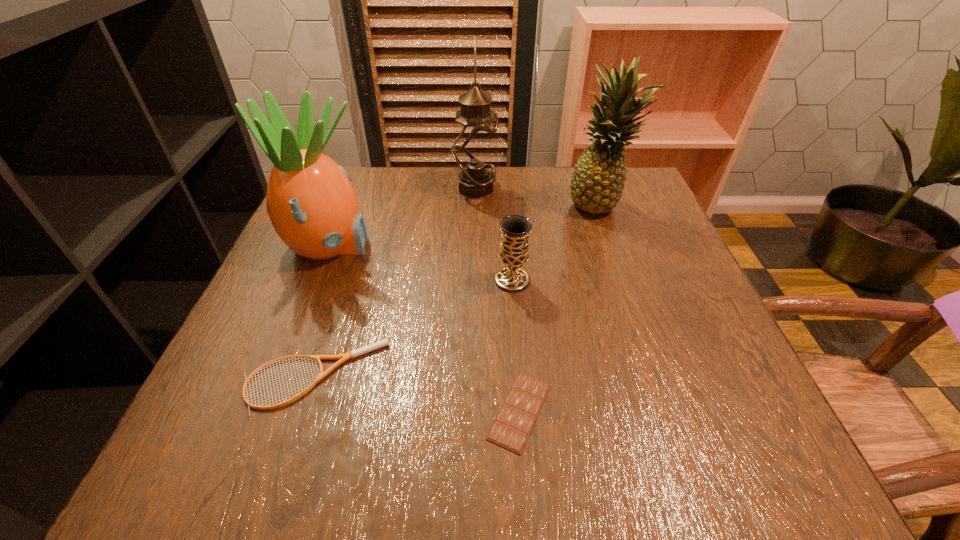
Image resolution: width=960 pixels, height=540 pixels. Identify the location of free space located 0.060m on the back of the tennis racket. (334, 316).

The image size is (960, 540). I want to click on vacant space located 0.120m on the back of the shortest object, so click(513, 319).

Locate an element on the screen. oil lamp that is at the far edge is located at coordinates (475, 132).

Find the location of a particular element. Image resolution: width=960 pixels, height=540 pixels. pineapple positioned at the far edge is located at coordinates (597, 182).

This screenshot has height=540, width=960. Identify the location of tennis racket that is at the near edge. (352, 354).

The width and height of the screenshot is (960, 540). I want to click on chocolate bar that is at the near edge, so click(514, 422).

In order to click on pineapple that is at the left edge in this screenshot , I will do [x=313, y=207].

I want to click on tennis racket that is positioned at the left edge, so click(352, 354).

This screenshot has height=540, width=960. I want to click on object at the right edge, so click(x=597, y=182).

Where is `object present at the near left corner`? The width and height of the screenshot is (960, 540). object present at the near left corner is located at coordinates (352, 354).